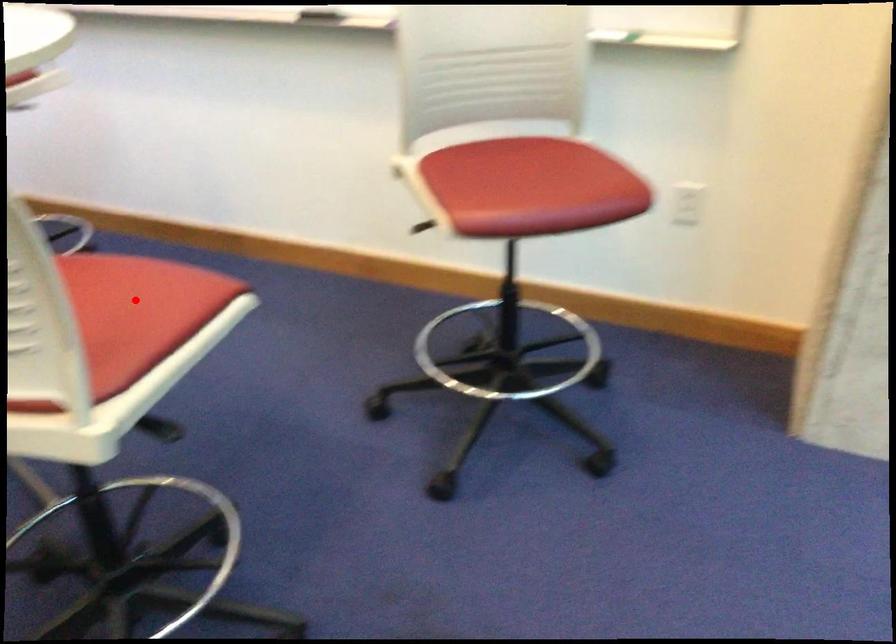
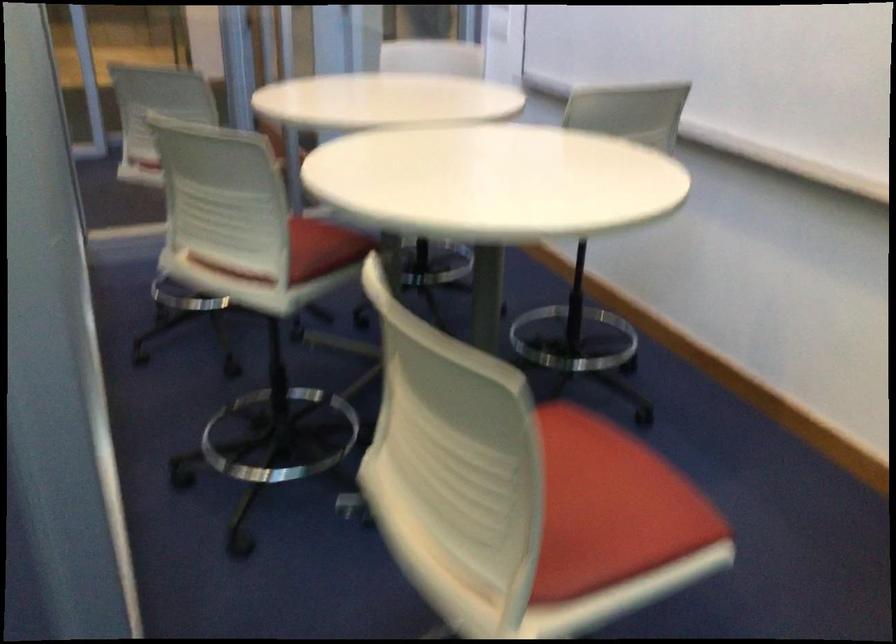
Locate, in the second image, the point that corresponds to the highlighted location in the first image.

(609, 507)